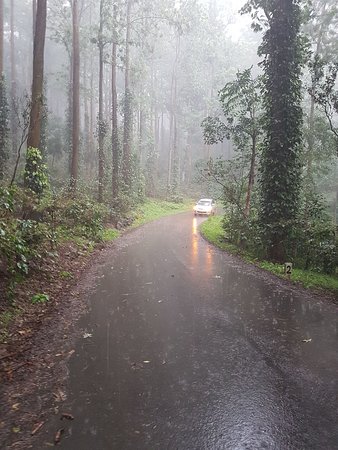
You are a GUI agent. You are given a task and a screenshot of the screen. Output one action in this format:
    pyautogui.click(x=<x>, y=<y>)
    Task: Click on the mirror
    The height and width of the screenshot is (450, 338).
    Given the screenshot: What is the action you would take?
    pyautogui.click(x=211, y=204)